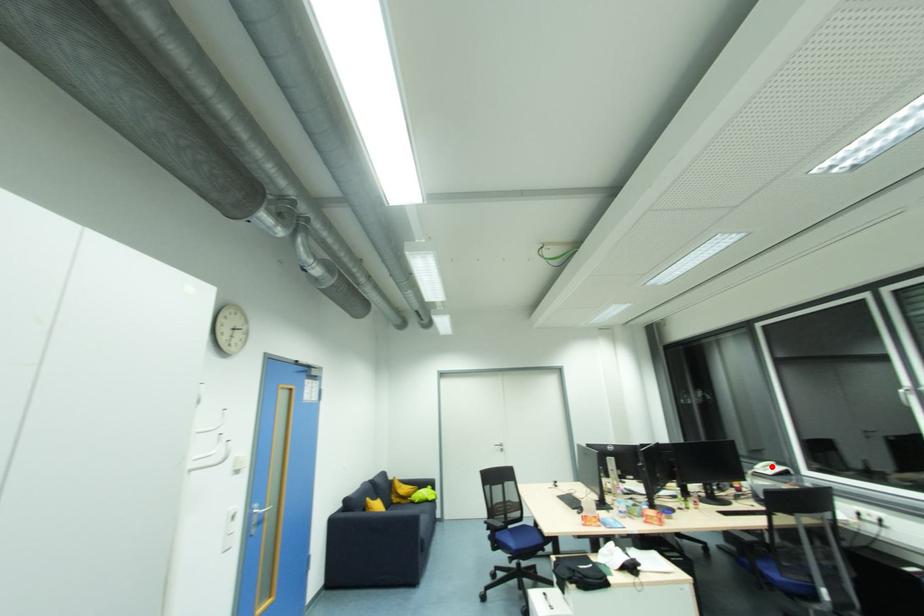
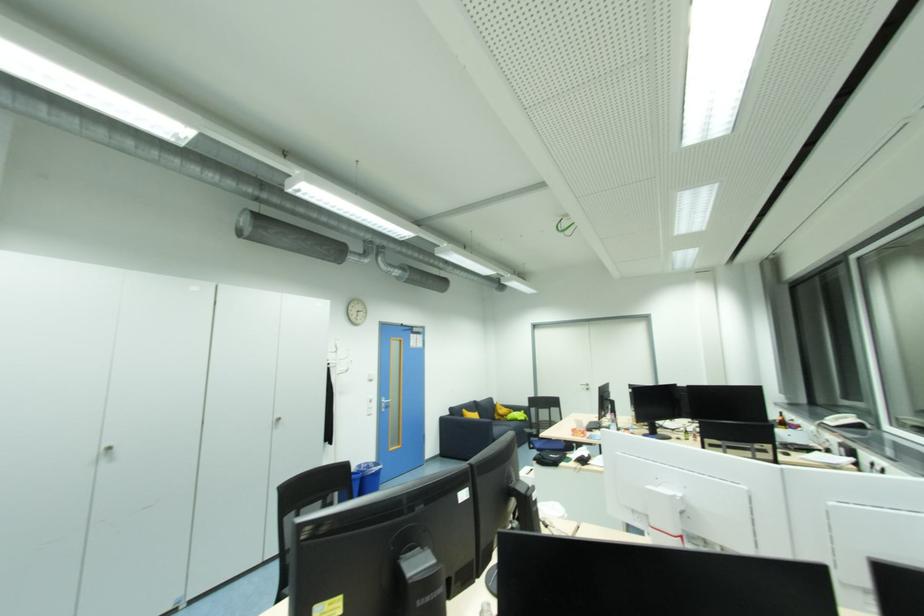
Locate, in the second image, the point that corresponds to the highlighted location in the first image.

(850, 419)